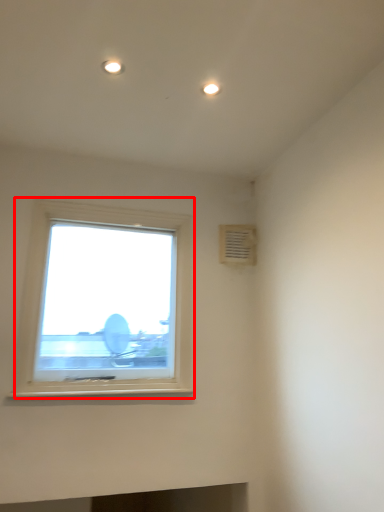
Question: From the image's perspective, where is window (annotated by the red box) located in relation to air conditioning in the image?

Choices:
 (A) above
 (B) below

Answer: (B)